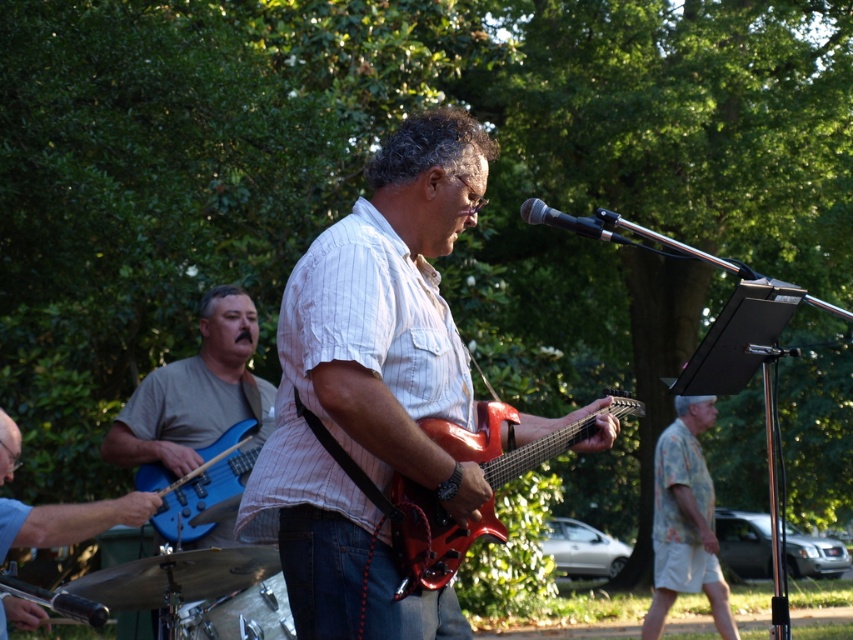
In the scene shown: You are a photographer at the live outdoor musical performance. You want to capture a closeup shot of the matte white shirt at center. What is the exact coordinate where you should focus your camera?

The exact coordinate to focus your camera is at point (373, 387) where the matte white shirt at center is located.